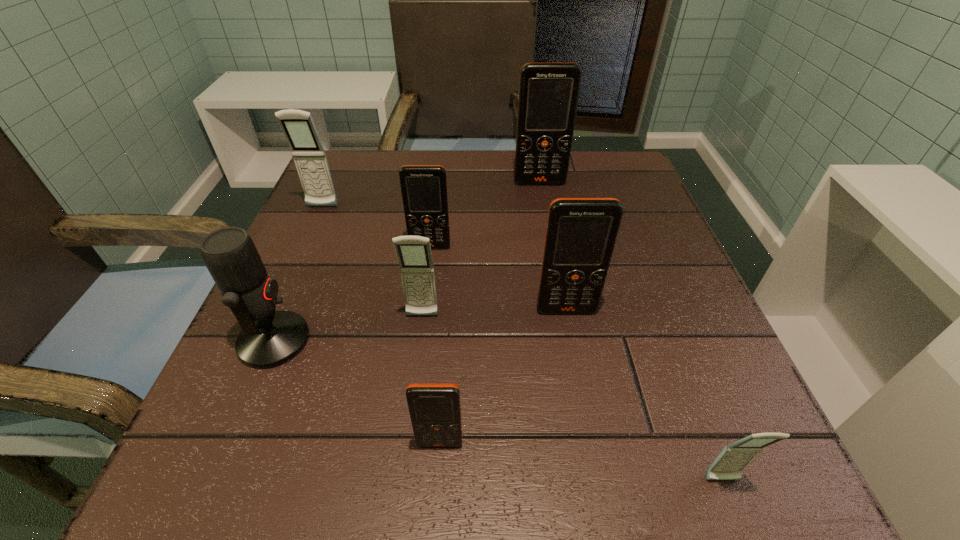
This screenshot has width=960, height=540. I want to click on the tallest cellular telephone, so click(x=548, y=92).

Find the location of a particular element. the farthest cellular telephone is located at coordinates (548, 92).

You are a GUI agent. You are given a task and a screenshot of the screen. Output one action in this format:
    pyautogui.click(x=<x>, y=<y>)
    Task: Click on the second farthest object
    
    Given the screenshot: What is the action you would take?
    pyautogui.click(x=309, y=156)

Identify the location of the leftmost cellular telephone. (309, 156).

You are a GUI agent. You are given a task and a screenshot of the screen. Output one action in this format:
    pyautogui.click(x=<x>, y=<y>)
    Task: Click on the second nearest orange cellular telephone
    
    Given the screenshot: What is the action you would take?
    pyautogui.click(x=581, y=233)

The image size is (960, 540). In order to click on microphone in this screenshot , I will do `click(269, 338)`.

This screenshot has height=540, width=960. I want to click on the second gray cellular telephone from left to right, so click(414, 255).

Identify the location of the second farthest gray cellular telephone. The image size is (960, 540). (414, 255).

Image resolution: width=960 pixels, height=540 pixels. Identify the location of the second farthest orange cellular telephone. (424, 187).

What are the coordinates of `the second smallest orange cellular telephone` in the screenshot? It's located at (424, 187).